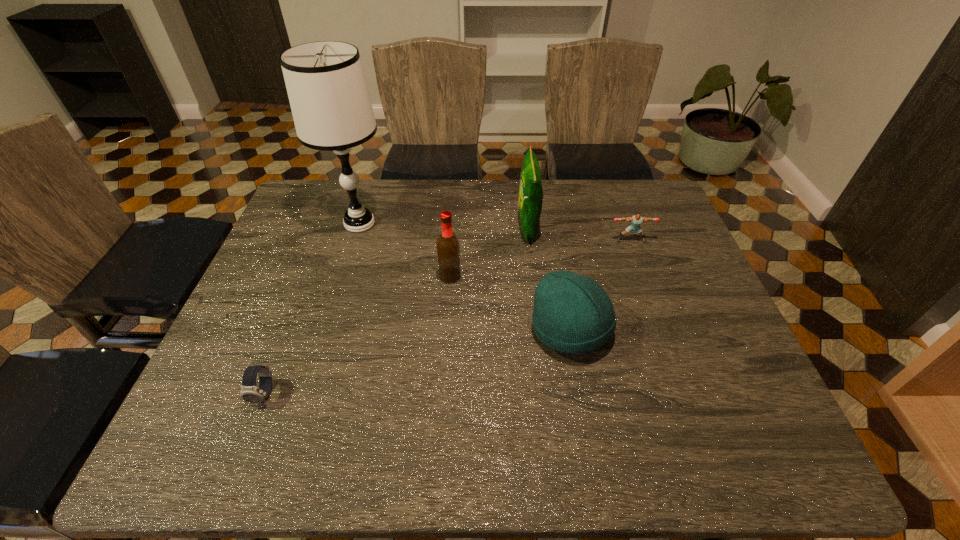
Choose which object is the third nearest neighbor to the table lamp. Please provide its 2D coordinates. Your answer should be formatted as a tuple, i.e. [(x, y)], where the tuple contains the x and y coordinates of a point satisfying the conditions above.

[(573, 314)]

In order to click on free space that satisfies the following two spatial constraints: 1. on the back side of the beanie; 2. on the front-facing side of the crisp (potato chip) in this screenshot , I will do `click(552, 228)`.

Identify the location of free space that satisfies the following two spatial constraints: 1. on the front-facing side of the crisp (potato chip); 2. on the back side of the fourth tallest object. tap(540, 330).